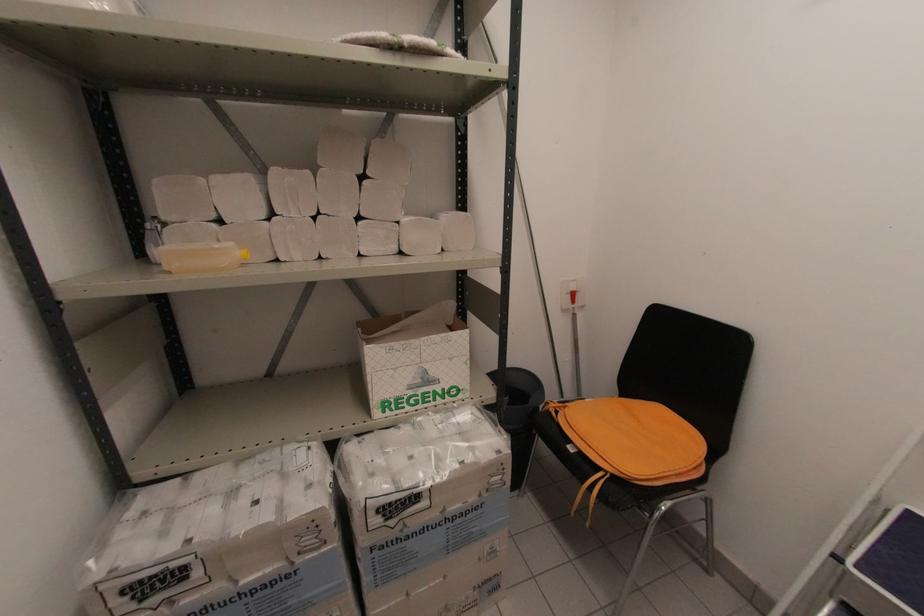
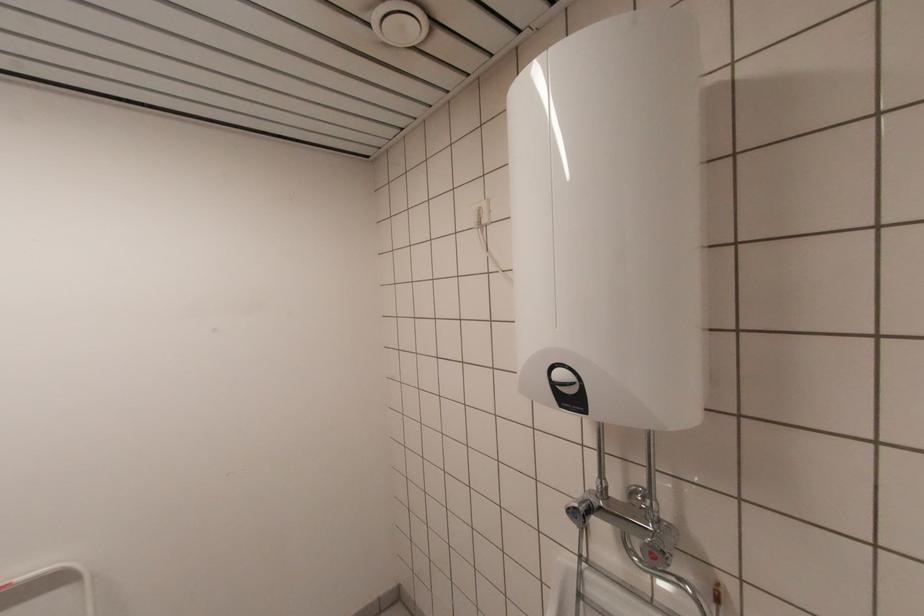
Question: The camera is either moving clockwise (left) or counter-clockwise (right) around the object. The first image is from the beginning of the video and the second image is from the end. Is the camera moving left or right when shooting the video?

Choices:
 (A) Left
 (B) Right

Answer: (A)